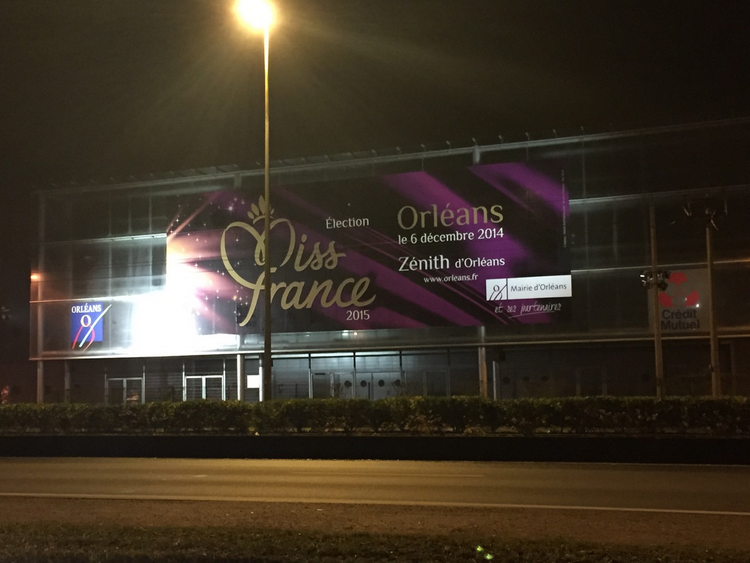
You are a GUI agent. You are given a task and a screenshot of the screen. Output one action in this format:
    pyautogui.click(x=<x>, y=<y>)
    Task: Click on the windows
    This screenshot has width=750, height=563.
    Given the screenshot: What is the action you would take?
    pyautogui.click(x=598, y=329)